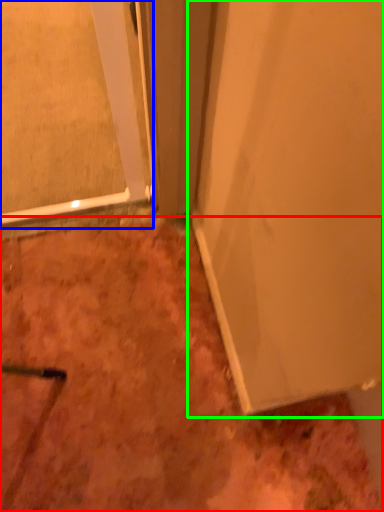
Question: Estimate the real-world distances between objects in this image. Which object is closer to dirt (highlighted by a red box), glass door (highlighted by a blue box) or door (highlighted by a green box)?

Choices:
 (A) glass door
 (B) door

Answer: (B)